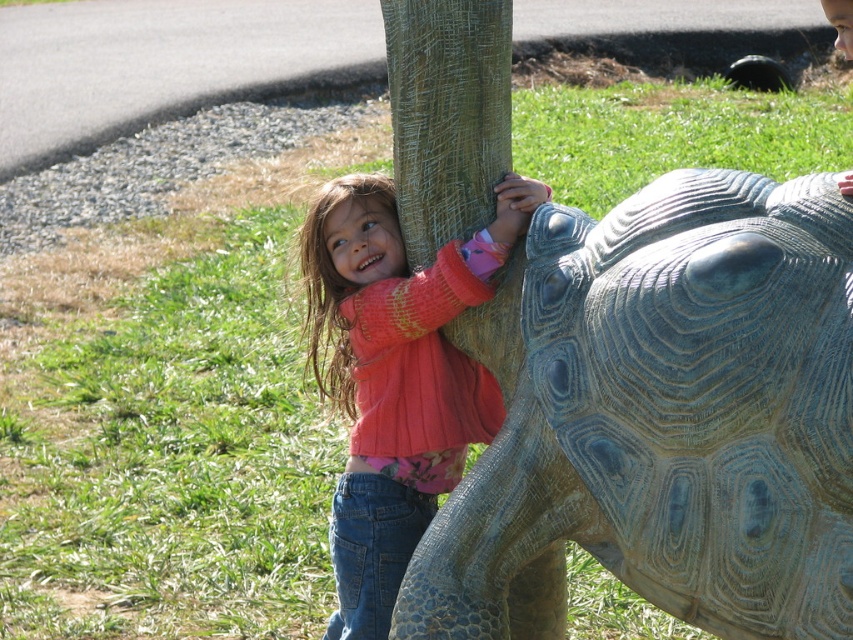
Question: Does green textured tortoise at center have a lesser width compared to pink sweater at center?

Choices:
 (A) no
 (B) yes

Answer: (A)

Question: Does green textured tortoise at center appear under pink sweater at center?

Choices:
 (A) no
 (B) yes

Answer: (B)

Question: Which of the following is the closest to the observer?

Choices:
 (A) (849, 488)
 (B) (367, 269)

Answer: (A)

Question: Which of the following is the farthest from the observer?

Choices:
 (A) pink sweater at center
 (B) green textured tortoise at center

Answer: (A)

Question: Considering the relative positions of green textured tortoise at center and pink sweater at center in the image provided, where is green textured tortoise at center located with respect to pink sweater at center?

Choices:
 (A) left
 (B) right

Answer: (B)